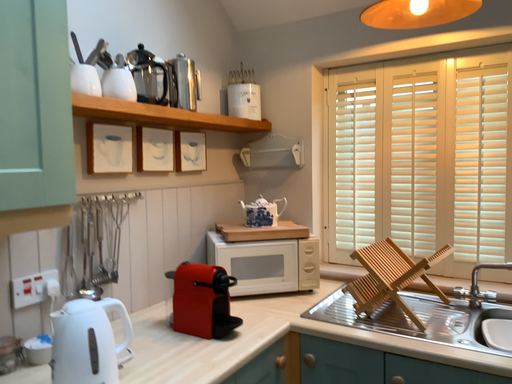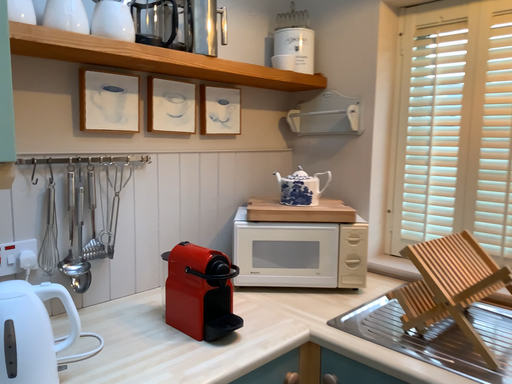
Question: How did the camera likely rotate when shooting the video?

Choices:
 (A) rotated left
 (B) rotated right

Answer: (A)